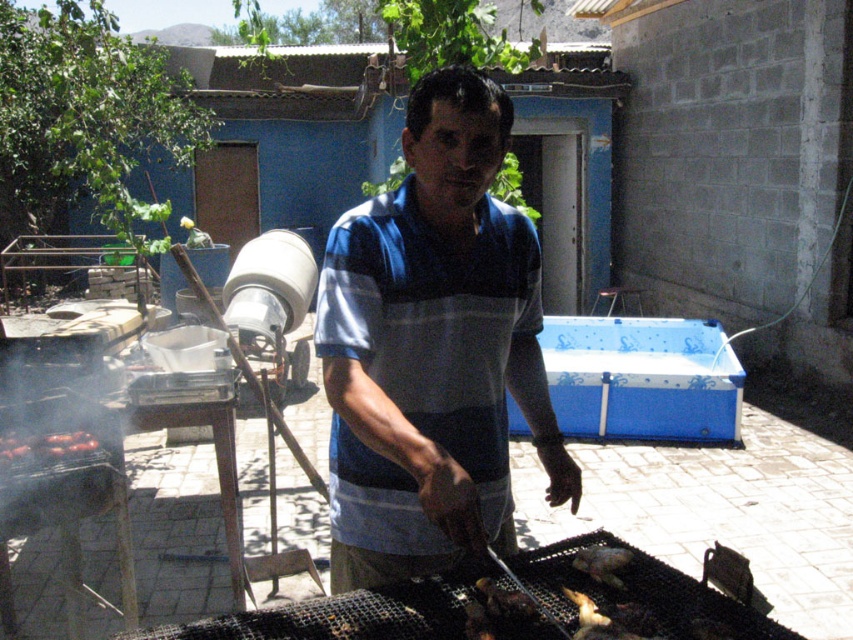
You are a guest at a backyard barbecue and want to choose the taller piece of meat between the smoked red meat at lower left and the charcoal grilled meat at center. Which one should you pick?

The smoked red meat at lower left is taller than the charcoal grilled meat at center, so you should pick the smoked red meat at lower left.

You are a guest at a barbecue and want to grab a piece of smoked red meat at lower left from your current position near the blue striped shirt at center. Can you reach it without moving your feet?

Result: The blue striped shirt at center is 4.72 feet from the smoked red meat at lower left. Since the distance is greater than an average person can reach, you cannot grab it without moving your feet.

You are a guest at a backyard barbecue and notice the blue striped shirt at center and the smoked red meat at lower left. Which object is taller?

The blue striped shirt at center is taller than the smoked red meat at lower left.